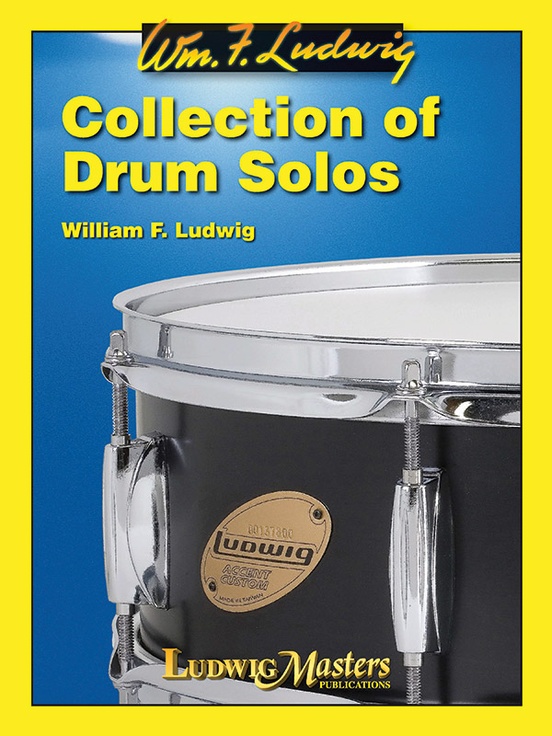
The width and height of the screenshot is (552, 736). I want to click on screws, so click(413, 369), click(110, 342), click(131, 700).